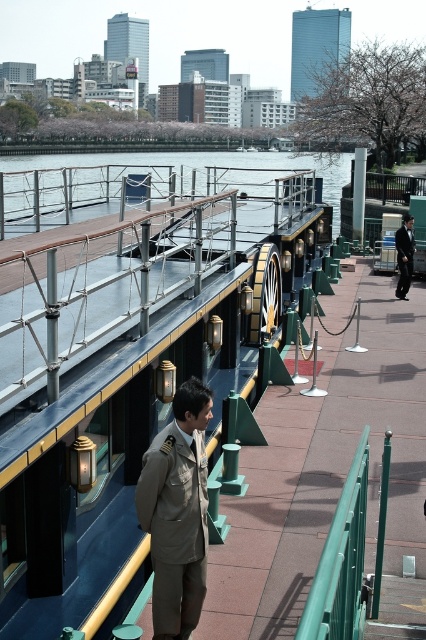
You are standing at the point marked as point (175, 528) in the waterfront scene. What object is located exactly at that point?

The khaki fabric trench coat at center is located exactly at point (175, 528).

You are standing on the walkway and want to take a photo of the boat. You notice two points on the boat deck marked as point (150, 444) and point (403, 276). Which point is closer to you when you are facing the boat?

Point (150, 444) is closer to the viewer than point (403, 276).